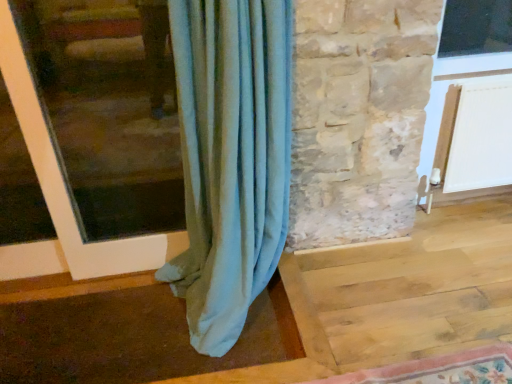
Question: Is matte white window frame at left completely or partially inside white plastic screen door at upper right?

Choices:
 (A) yes
 (B) no

Answer: (B)

Question: Can you confirm if white plastic screen door at upper right is smaller than matte white window frame at left?

Choices:
 (A) no
 (B) yes

Answer: (A)

Question: Is white plastic screen door at upper right not close to matte white window frame at left?

Choices:
 (A) yes
 (B) no

Answer: (A)

Question: Is white plastic screen door at upper right wider than matte white window frame at left?

Choices:
 (A) yes
 (B) no

Answer: (A)

Question: Is white plastic screen door at upper right thinner than matte white window frame at left?

Choices:
 (A) no
 (B) yes

Answer: (A)

Question: Considering the positions of white plastic screen door at upper right and matte white window frame at left in the image, is white plastic screen door at upper right bigger or smaller than matte white window frame at left?

Choices:
 (A) small
 (B) big

Answer: (B)

Question: Is white plastic screen door at upper right in front of or behind matte white window frame at left in the image?

Choices:
 (A) behind
 (B) front

Answer: (A)

Question: Would you say white plastic screen door at upper right is inside or outside matte white window frame at left?

Choices:
 (A) inside
 (B) outside

Answer: (B)

Question: Considering the positions of white plastic screen door at upper right and matte white window frame at left in the image, is white plastic screen door at upper right wider or thinner than matte white window frame at left?

Choices:
 (A) thin
 (B) wide

Answer: (B)

Question: Considering the positions of white plastic screen door at upper right and rug with floral pattern at lower right in the image, is white plastic screen door at upper right taller or shorter than rug with floral pattern at lower right?

Choices:
 (A) tall
 (B) short

Answer: (A)

Question: Based on their sizes in the image, would you say white plastic screen door at upper right is bigger or smaller than rug with floral pattern at lower right?

Choices:
 (A) big
 (B) small

Answer: (A)

Question: Considering their positions, is white plastic screen door at upper right located in front of or behind rug with floral pattern at lower right?

Choices:
 (A) behind
 (B) front

Answer: (A)

Question: In terms of width, does white plastic screen door at upper right look wider or thinner when compared to rug with floral pattern at lower right?

Choices:
 (A) wide
 (B) thin

Answer: (B)

Question: From their relative heights in the image, would you say rug with floral pattern at lower right is taller or shorter than matte white window frame at left?

Choices:
 (A) tall
 (B) short

Answer: (B)

Question: Is rug with floral pattern at lower right wider or thinner than matte white window frame at left?

Choices:
 (A) wide
 (B) thin

Answer: (A)